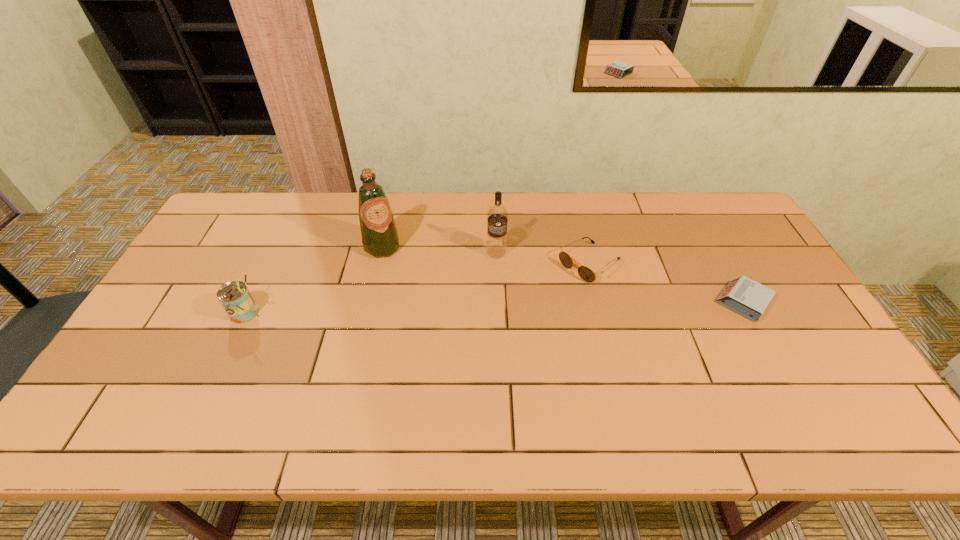
The image size is (960, 540). Identify the location of vacant spot on the desktop that is between the leftmost object and the rightmost object and is positioned on the label of the vodka. (490, 307).

Where is `free space on the desktop that is between the third tallest object and the alarm clock and is positioned on the front-facing side of the olive oil`? free space on the desktop that is between the third tallest object and the alarm clock and is positioned on the front-facing side of the olive oil is located at coordinates (422, 309).

This screenshot has width=960, height=540. I want to click on free spot on the desktop that is between the leftmost object and the alarm clock and is positioned on the lenses of the second object from right to left, so click(529, 307).